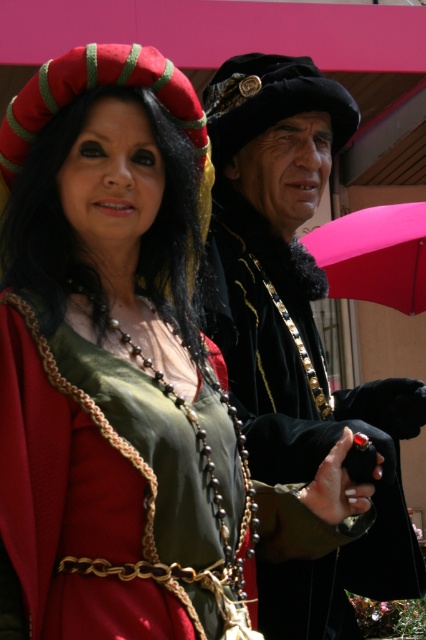
Between velvet black coat at center and green satin dress at center, which one is positioned higher?

Positioned higher is velvet black coat at center.

Between velvet black coat at center and green satin dress at center, which one has less height?

Standing shorter between the two is green satin dress at center.

What do you see at coordinates (299, 333) in the screenshot? I see `velvet black coat at center` at bounding box center [299, 333].

Identify the location of velvet black coat at center. (299, 333).

Locate an element on the screen. green satin dress at center is located at coordinates (100, 492).

Is green satin dress at center taller than pink fabric umbrella at upper right?

No.

Identify the location of green satin dress at center. The height and width of the screenshot is (640, 426). (100, 492).

Where is `green satin dress at center`? Image resolution: width=426 pixels, height=640 pixels. green satin dress at center is located at coordinates (100, 492).

Between point (333, 416) and point (408, 227), which one is positioned in front?

Positioned in front is point (333, 416).

Looking at this image, does velvet black coat at center appear on the right side of pink fabric umbrella at upper right?

No, velvet black coat at center is not to the right of pink fabric umbrella at upper right.

What do you see at coordinates (299, 333) in the screenshot? I see `velvet black coat at center` at bounding box center [299, 333].

Image resolution: width=426 pixels, height=640 pixels. Identify the location of velvet black coat at center. (299, 333).